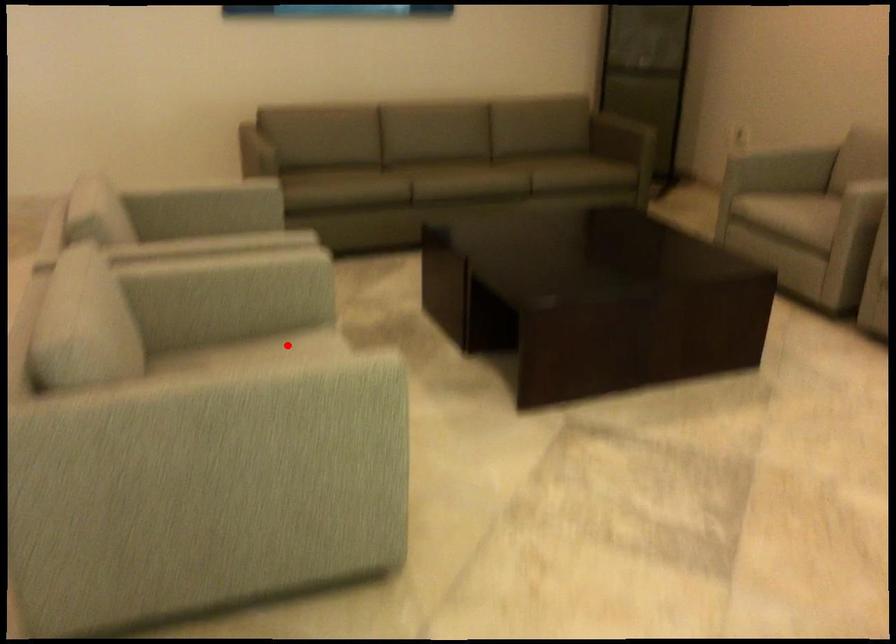
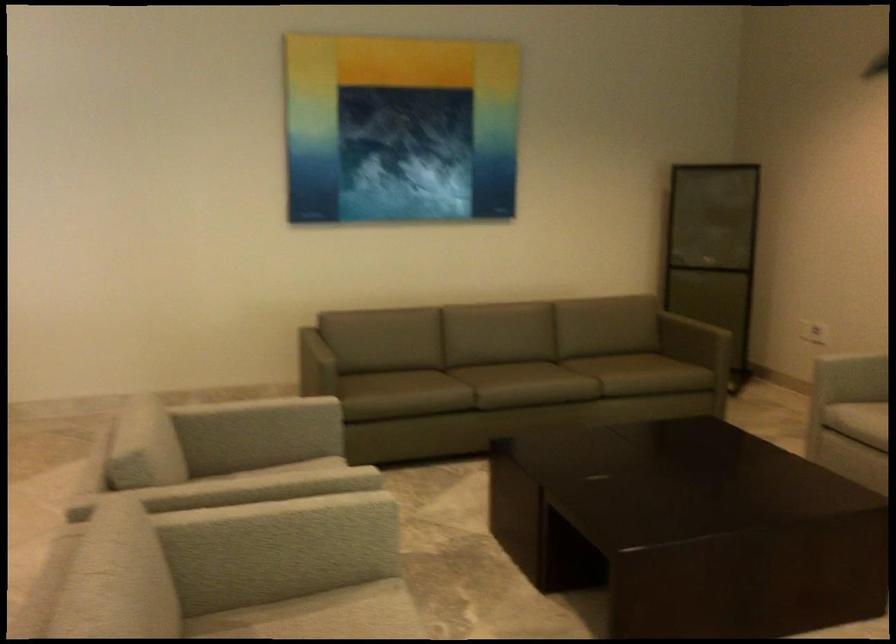
Where in the second image is the point corresponding to the highlighted location from the first image?

(348, 614)